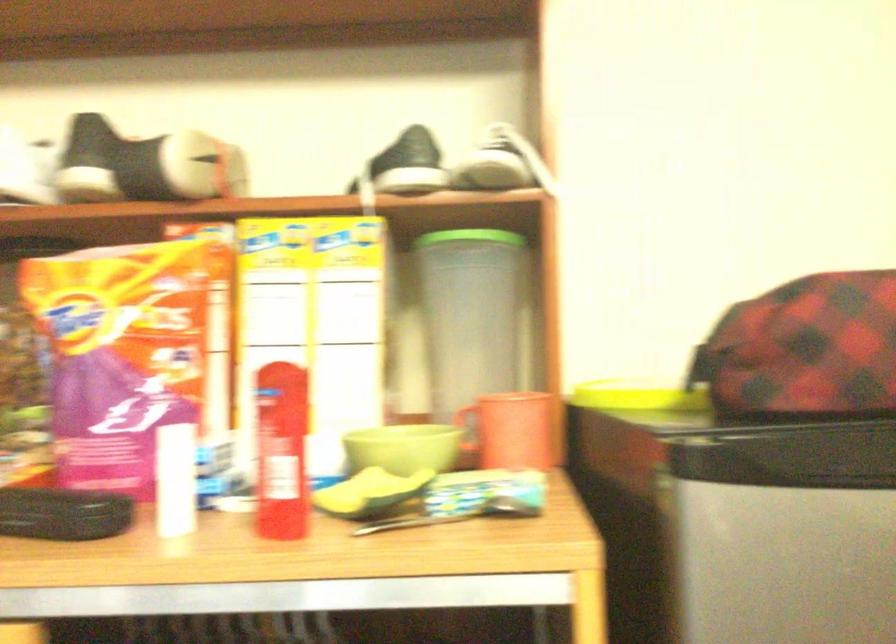
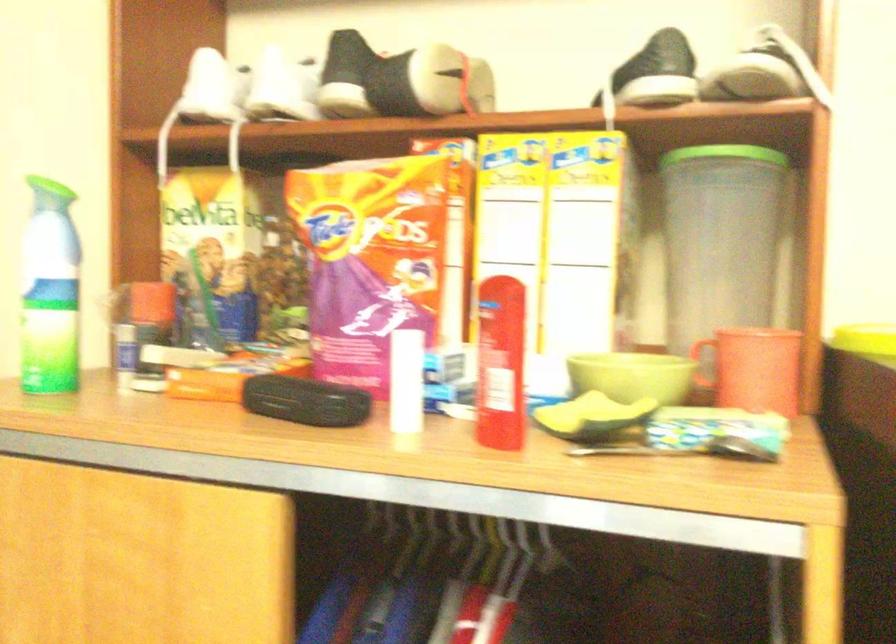
Find the pixel in the second image that matches (x=471, y=238) in the first image.

(725, 153)